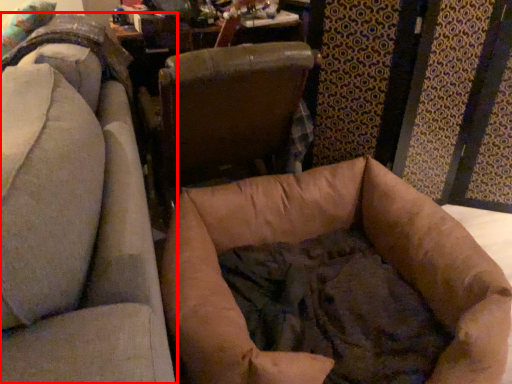
Question: From the image, what is the correct spatial relationship of chair (annotated by the red box) in relation to chair?

Choices:
 (A) right
 (B) left

Answer: (B)